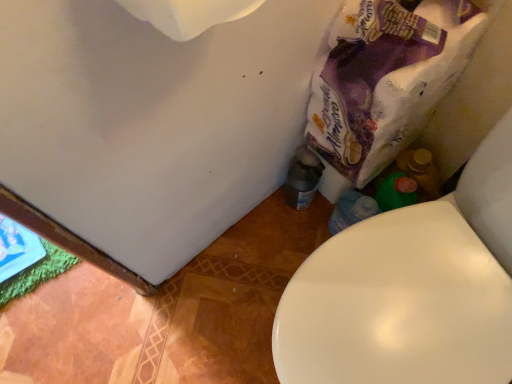
Where is `white glossy toilet at lower right`? The height and width of the screenshot is (384, 512). white glossy toilet at lower right is located at coordinates (410, 289).

This screenshot has height=384, width=512. What do you see at coordinates (410, 289) in the screenshot? I see `white glossy toilet at lower right` at bounding box center [410, 289].

Find the location of a particular element. The height and width of the screenshot is (384, 512). white glossy toilet at lower right is located at coordinates (410, 289).